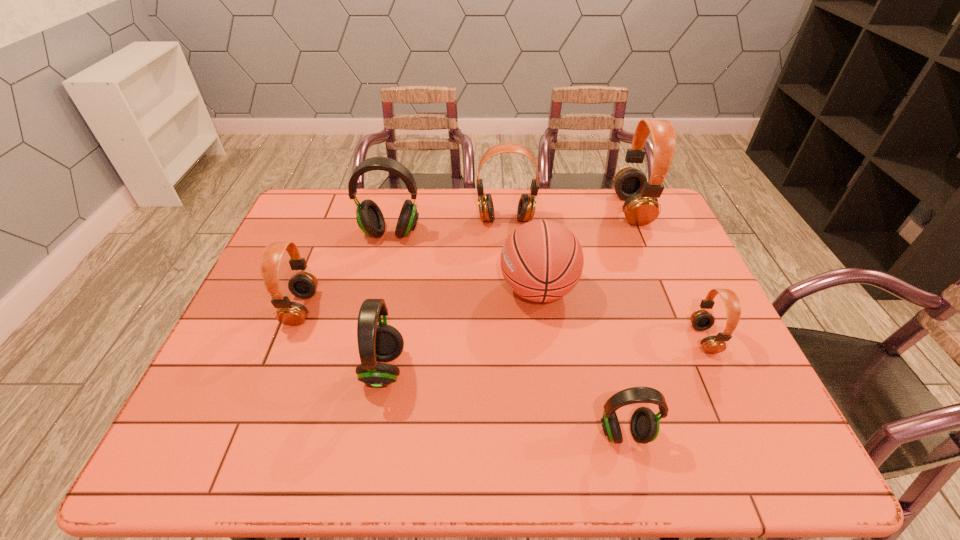
Locate an element on the screen. the nearest black headset is located at coordinates (644, 425).

At what (x,y) coordinates should I click in order to perform the action: click on the nearest headset. Please return your answer as a coordinate pair (x, y). Looking at the image, I should click on (644, 425).

The height and width of the screenshot is (540, 960). I want to click on free point located on the ear cups of the tallest object, so click(601, 209).

I want to click on blank space located 0.240m on the ear cups of the tallest object, so click(544, 209).

I want to click on free space located on the ear cups of the tallest object, so click(x=539, y=209).

Locate an element on the screen. The width and height of the screenshot is (960, 540). free point located 0.150m on the ear cups of the farthest black headset is located at coordinates [379, 279].

Locate an element on the screen. vacant space located on the ear cups of the third smallest brown headset is located at coordinates (507, 239).

The image size is (960, 540). Find the location of `free space located on the logo side of the orange basketball`. free space located on the logo side of the orange basketball is located at coordinates (478, 290).

Image resolution: width=960 pixels, height=540 pixels. I want to click on vacant point located 0.280m on the logo side of the orange basketball, so click(x=398, y=290).

The height and width of the screenshot is (540, 960). Identify the location of vacant area located 0.370m on the logo side of the orange basketball. (366, 290).